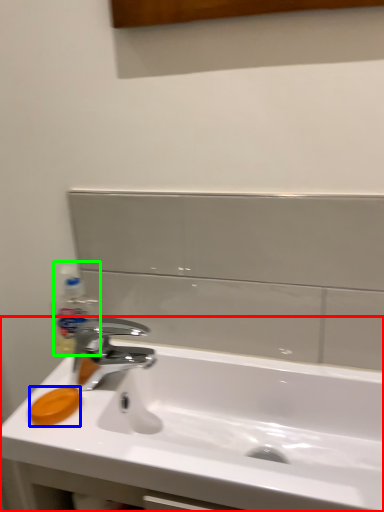
Question: Which object is positioned closest to sink (highlighted by a red box)? Select from soap (highlighted by a blue box) and bottle (highlighted by a green box).

Choices:
 (A) soap
 (B) bottle

Answer: (A)